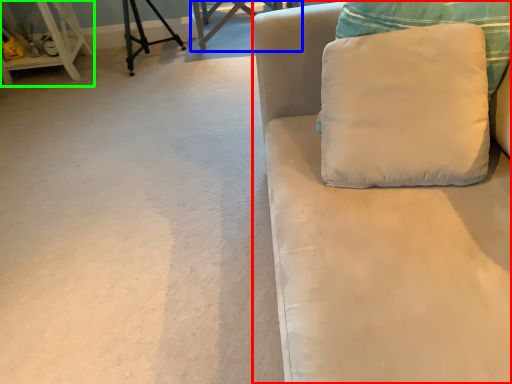
Question: Which object is positioned farthest from studio couch (highlighted by a red box)? Select from table (highlighted by a blue box) and furniture (highlighted by a green box).

Choices:
 (A) table
 (B) furniture

Answer: (B)